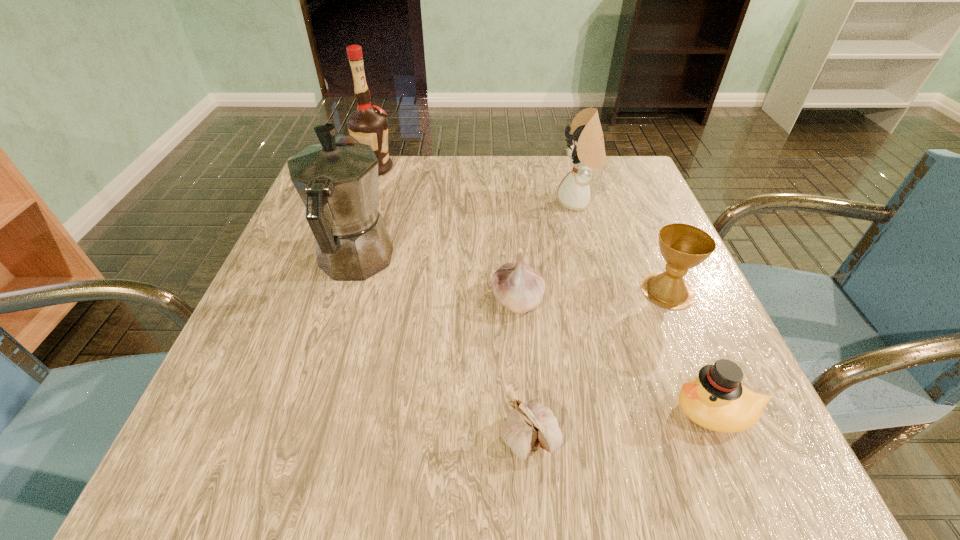
Identify the location of free space that satisfies the following two spatial constraints: 1. at the front face of the fifth object from left to right; 2. on the left side of the chalice. (602, 290).

This screenshot has width=960, height=540. Identify the location of blank space that satisfies the following two spatial constraints: 1. on the back side of the chalice; 2. at the front face of the fifth shortest object. (630, 202).

You are a GUI agent. You are given a task and a screenshot of the screen. Output one action in this format:
    pyautogui.click(x=<x>, y=<y>)
    Task: Click on the free space that satisfies the following two spatial constraints: 1. on the pouring side of the coffeepot; 2. on the front and back of the farthest object
    The width and height of the screenshot is (960, 540).
    Given the screenshot: What is the action you would take?
    pyautogui.click(x=383, y=168)